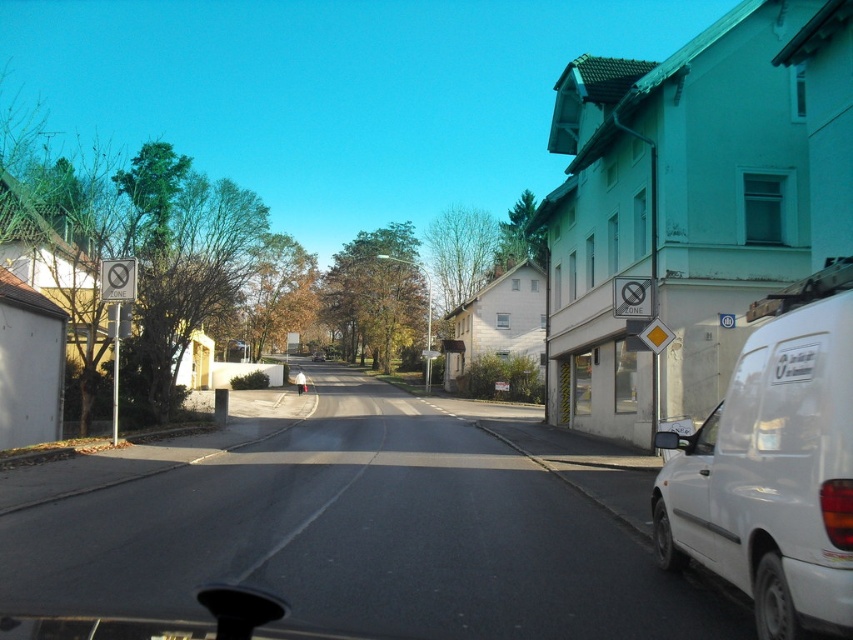
Question: Can you confirm if white matte van at right is positioned below metallic silver car at center?

Choices:
 (A) no
 (B) yes

Answer: (A)

Question: Does white matte van at right appear over metallic silver car at center?

Choices:
 (A) no
 (B) yes

Answer: (B)

Question: Does white matte van at right lie behind metallic silver car at center?

Choices:
 (A) no
 (B) yes

Answer: (A)

Question: Which point is closer to the camera?

Choices:
 (A) (315, 358)
 (B) (842, 419)

Answer: (B)